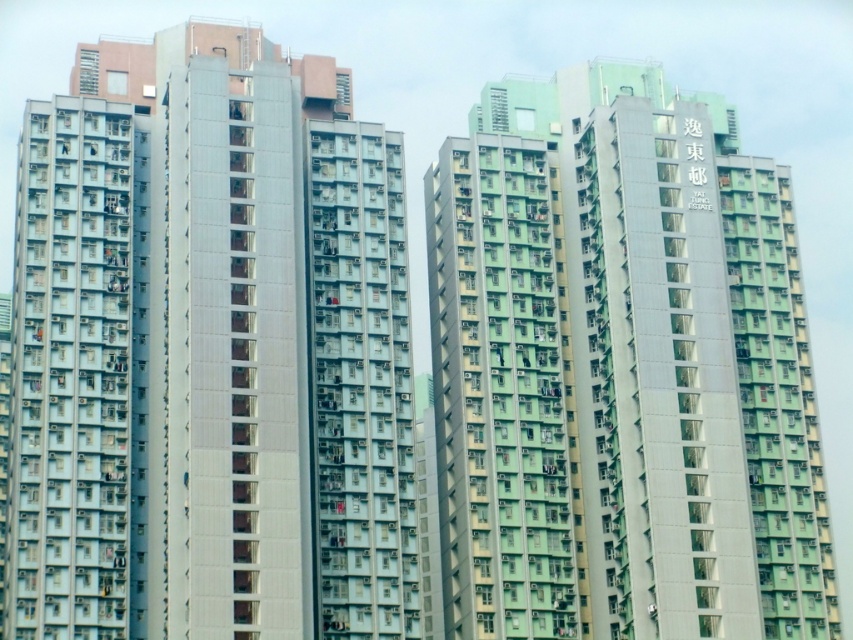
From the picture: You are a drone operator planning to fly a drone between the white glossy building at center and the green matte building at center. Based on their positions, which building is directly above the other?

The white glossy building at center is positioned under the green matte building at center, so the green matte building at center is directly above the white glossy building at center.

In the scene shown: You are a city planner analyzing the layout of two buildings in the image. Given that the white glossy building at center and the green matte building at center are adjacent, which one would require more space if they were to be expanded horizontally while maintaining their current design proportions?

The green matte building at center would require more space because its width is greater than the white glossy building at center, so expanding it would need more area to maintain proportions.